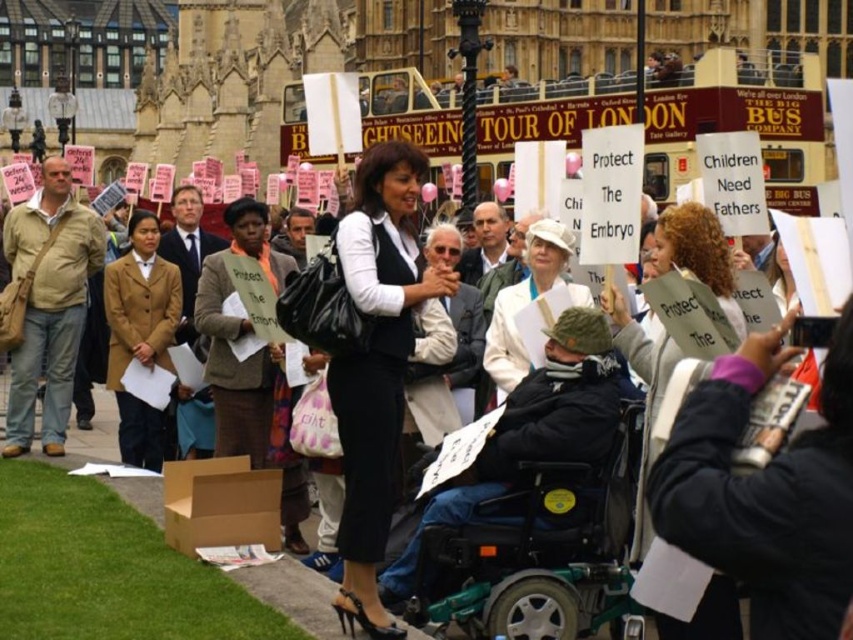
Which is more to the right, matte black vest at center or white fabric jacket at center?

From the viewer's perspective, white fabric jacket at center appears more on the right side.

Between matte black vest at center and white fabric jacket at center, which one is positioned higher?

white fabric jacket at center

What do you see at coordinates (376, 365) in the screenshot? I see `matte black vest at center` at bounding box center [376, 365].

The height and width of the screenshot is (640, 853). Identify the location of matte black vest at center. (376, 365).

Consider the image. Is teal plastic wheelchair at center smaller than matte brown coat at left?

Yes.

Between teal plastic wheelchair at center and matte brown coat at left, which one appears on the left side from the viewer's perspective?

matte brown coat at left is more to the left.

Measure the distance between point (454, 602) and camera.

49.15 meters

You are a GUI agent. You are given a task and a screenshot of the screen. Output one action in this format:
    pyautogui.click(x=<x>, y=<y>)
    Task: Click on the teal plastic wheelchair at center
    This screenshot has width=853, height=640.
    Given the screenshot: What is the action you would take?
    pyautogui.click(x=538, y=550)

Is teal plastic wheelchair at center wider than matte black vest at center?

Indeed, teal plastic wheelchair at center has a greater width compared to matte black vest at center.

Is teal plastic wheelchair at center below matte black vest at center?

Yes.

Which is in front, point (494, 540) or point (407, 257)?

Point (494, 540) is in front.

Find the location of a particular element. This screenshot has width=853, height=640. teal plastic wheelchair at center is located at coordinates (538, 550).